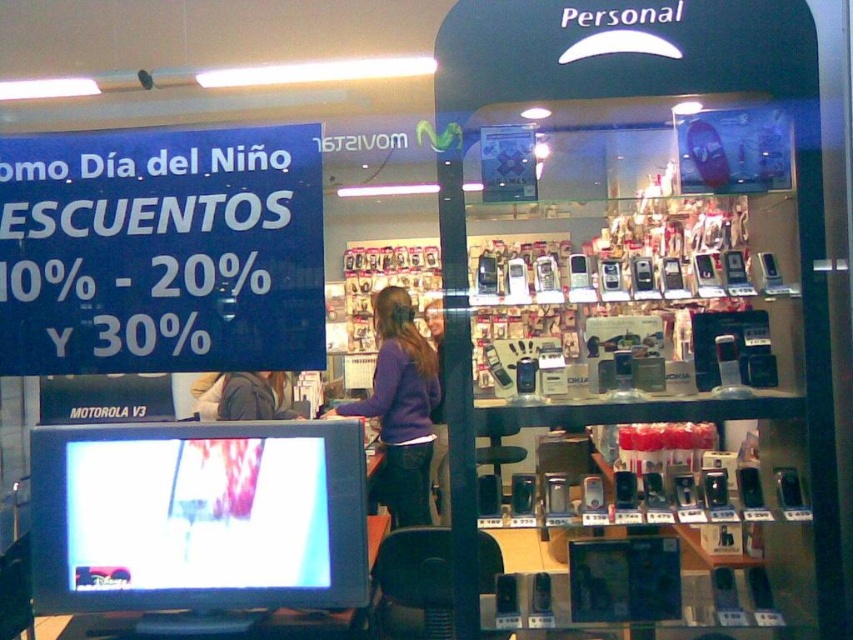
Question: Which object appears farthest from the camera in this image?

Choices:
 (A) matte black monitor at lower left
 (B) dark gray jacket at center
 (C) purple sweater at center

Answer: (C)

Question: Is purple sweater at center above dark gray jacket at center?

Choices:
 (A) yes
 (B) no

Answer: (B)

Question: Among these points, which one is nearest to the camera?

Choices:
 (A) [x=267, y=410]
 (B) [x=416, y=481]
 (C) [x=164, y=470]

Answer: (C)

Question: In this image, where is matte black monitor at lower left located relative to dark gray jacket at center?

Choices:
 (A) left
 (B) right

Answer: (B)

Question: Considering the real-world distances, which object is closest to the matte black monitor at lower left?

Choices:
 (A) purple sweater at center
 (B) dark gray jacket at center

Answer: (B)

Question: Is matte black monitor at lower left further to the viewer compared to dark gray jacket at center?

Choices:
 (A) no
 (B) yes

Answer: (A)